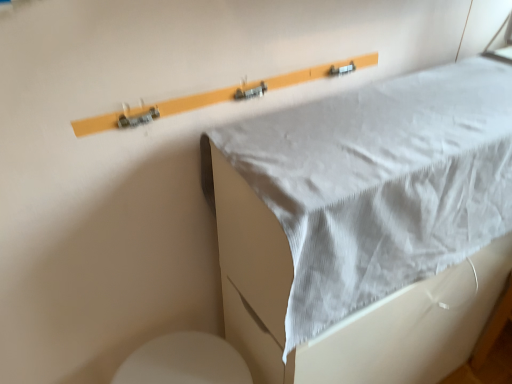
Question: Is white fabric at upper center closer to the viewer compared to white glossy toilet at lower left?

Choices:
 (A) no
 (B) yes

Answer: (B)

Question: From the image's perspective, is white fabric at upper center located above white glossy toilet at lower left?

Choices:
 (A) no
 (B) yes

Answer: (B)

Question: Does white fabric at upper center appear on the right side of white glossy toilet at lower left?

Choices:
 (A) no
 (B) yes

Answer: (B)

Question: From the image's perspective, does white fabric at upper center appear lower than white glossy toilet at lower left?

Choices:
 (A) no
 (B) yes

Answer: (A)

Question: Can you confirm if white fabric at upper center is smaller than white glossy toilet at lower left?

Choices:
 (A) no
 (B) yes

Answer: (A)

Question: Can you confirm if white fabric at upper center is bigger than white glossy toilet at lower left?

Choices:
 (A) yes
 (B) no

Answer: (A)

Question: Is white glossy toilet at lower left positioned beyond the bounds of white fabric at upper center?

Choices:
 (A) yes
 (B) no

Answer: (A)

Question: Does white glossy toilet at lower left have a lesser width compared to white fabric at upper center?

Choices:
 (A) no
 (B) yes

Answer: (B)

Question: Can you confirm if white glossy toilet at lower left is wider than white fabric at upper center?

Choices:
 (A) yes
 (B) no

Answer: (B)

Question: Does white glossy toilet at lower left have a greater height compared to white fabric at upper center?

Choices:
 (A) yes
 (B) no

Answer: (B)

Question: Considering the relative positions of white glossy toilet at lower left and white fabric at upper center in the image provided, is white glossy toilet at lower left in front of white fabric at upper center?

Choices:
 (A) yes
 (B) no

Answer: (B)

Question: From a real-world perspective, is white glossy toilet at lower left beneath white fabric at upper center?

Choices:
 (A) no
 (B) yes

Answer: (B)

Question: From a real-world perspective, is white fabric at upper center physically located above or below white glossy toilet at lower left?

Choices:
 (A) below
 (B) above

Answer: (B)